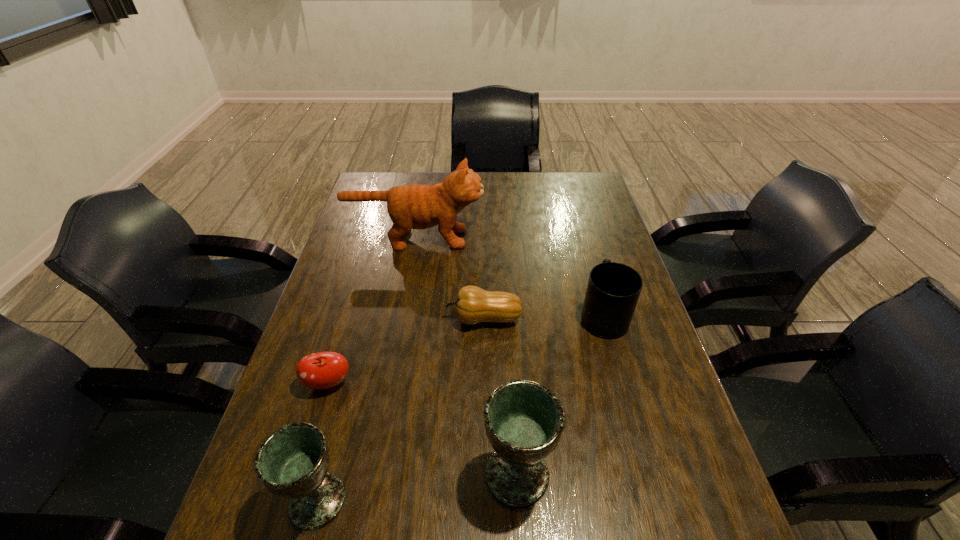
At what (x,y) coordinates should I click in order to perform the action: click on the left chalice. Please return your answer as a coordinate pair (x, y). The width and height of the screenshot is (960, 540). Looking at the image, I should click on (292, 462).

At what (x,y) coordinates should I click in order to perform the action: click on the shorter chalice. Please return your answer as a coordinate pair (x, y). Image resolution: width=960 pixels, height=540 pixels. Looking at the image, I should click on (292, 462).

The height and width of the screenshot is (540, 960). Identify the location of the second tallest object. (524, 420).

At what (x,y) coordinates should I click in order to perform the action: click on the taller chalice. Please return your answer as a coordinate pair (x, y). This screenshot has width=960, height=540. Looking at the image, I should click on (524, 420).

This screenshot has width=960, height=540. Find the location of `cat`. cat is located at coordinates (415, 206).

The height and width of the screenshot is (540, 960). Find the location of `the tallest object`. the tallest object is located at coordinates (415, 206).

You are a GUI agent. You are given a task and a screenshot of the screen. Output one action in this format:
    pyautogui.click(x=<x>, y=<y>)
    Task: Click on the mug
    The image size is (960, 540).
    Given the screenshot: What is the action you would take?
    pyautogui.click(x=613, y=290)

The image size is (960, 540). I want to click on the third shortest object, so click(x=613, y=290).

The width and height of the screenshot is (960, 540). What are the coordinates of `the third nearest object` in the screenshot? It's located at (x=323, y=370).

In order to click on gourd in this screenshot , I will do `click(473, 305)`.